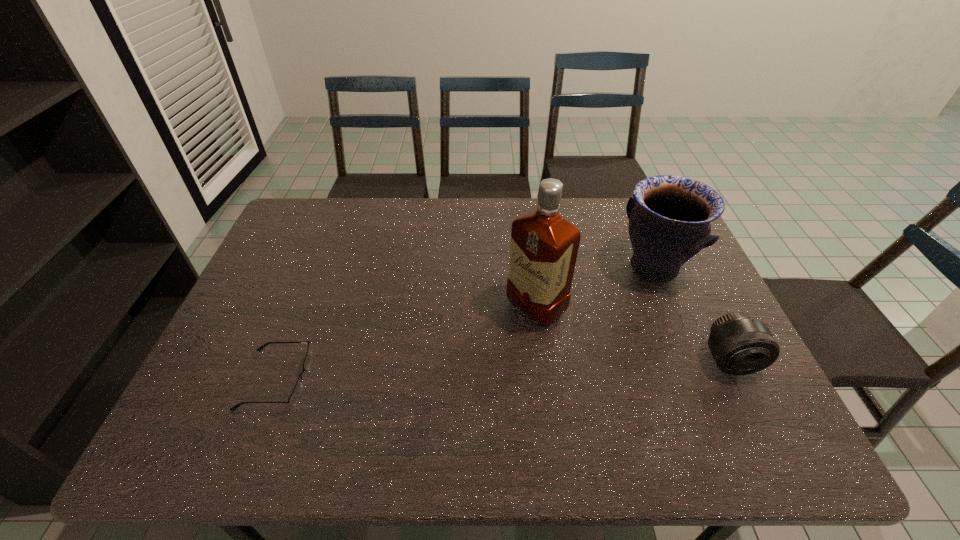
Where is `free space located on the front handle of the second tallest object`? free space located on the front handle of the second tallest object is located at coordinates (544, 354).

The image size is (960, 540). I want to click on vacant space located 0.300m on the front handle of the second tallest object, so click(x=561, y=341).

At what (x,y) coordinates should I click in order to perform the action: click on vacant space positioned on the front handle of the second tallest object. Please return your answer as a coordinate pair (x, y). This screenshot has height=540, width=960. Looking at the image, I should click on (588, 320).

The height and width of the screenshot is (540, 960). I want to click on spectacles present at the near edge, so [293, 399].

The image size is (960, 540). Identify the location of telephoto lens positioned at the near edge. (740, 345).

Locate an element on the screen. object present at the left edge is located at coordinates (293, 399).

Where is `telephoto lens present at the right edge`? The width and height of the screenshot is (960, 540). telephoto lens present at the right edge is located at coordinates (740, 345).

You are a GUI agent. You are given a task and a screenshot of the screen. Output one action in this format:
    pyautogui.click(x=<x>, y=<y>)
    Task: Click on the pottery positioned at the right edge
    The height and width of the screenshot is (540, 960).
    Given the screenshot: What is the action you would take?
    pyautogui.click(x=669, y=216)

Find the location of `object that is at the near left corner`. object that is at the near left corner is located at coordinates (293, 399).

Identify the location of object at the near right corner. (740, 345).